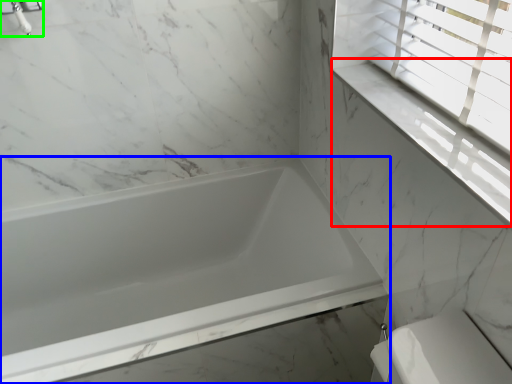
Question: Based on their relative distances, which object is nearer to window sill (highlighted by a red box)? Choose from bathtub (highlighted by a blue box) and faucet (highlighted by a green box).

Choices:
 (A) bathtub
 (B) faucet

Answer: (A)